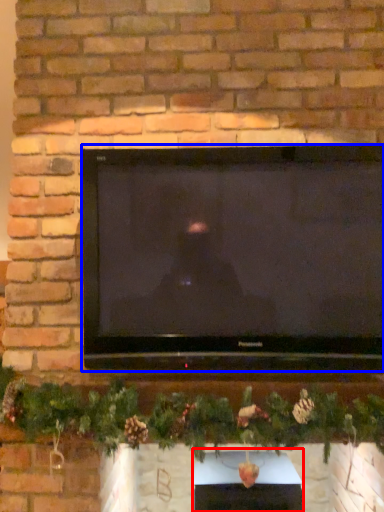
Question: Among these objects, which one is nearest to the camera, fireplace (highlighted by a red box) or television (highlighted by a blue box)?

Choices:
 (A) fireplace
 (B) television

Answer: (B)